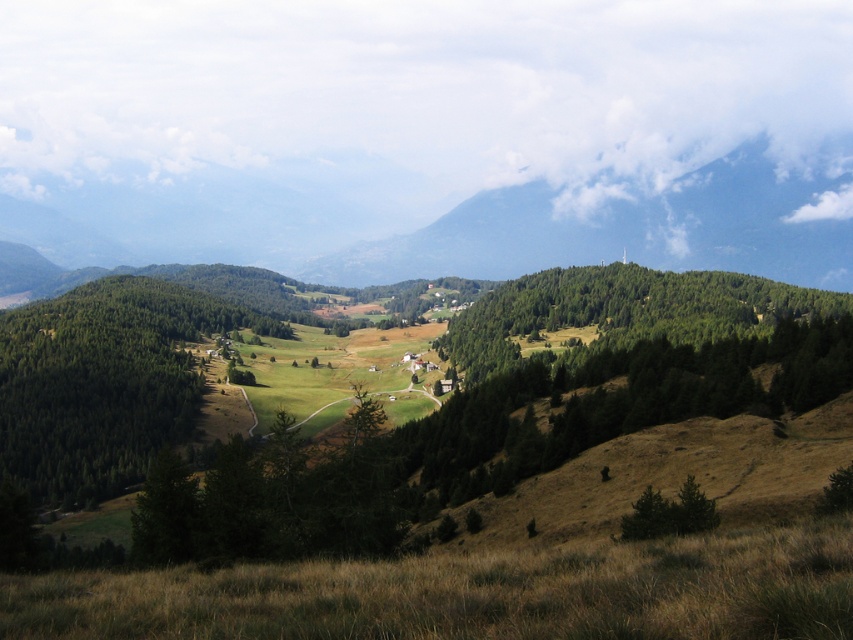
Is point (546, 221) positioned behind point (676, 339)?

Yes, it is.

Between point (544, 236) and point (596, 310), which one is positioned behind?

The point (544, 236) is more distant.

You are a GUI agent. You are given a task and a screenshot of the screen. Output one action in this format:
    pyautogui.click(x=<x>, y=<y>)
    Task: Click on the green forested mountain at upper center
    
    Given the screenshot: What is the action you would take?
    pyautogui.click(x=550, y=230)

Which is in front, point (273, 260) or point (48, 428)?

Point (48, 428)

How far apart are green forested mountain at upper center and green matte tree at lower left?

green forested mountain at upper center and green matte tree at lower left are 410.50 meters apart from each other.

Is point (732, 208) positioned before point (177, 442)?

No, it is not.

The width and height of the screenshot is (853, 640). In order to click on green forested mountain at upper center in this screenshot , I will do `click(550, 230)`.

Is green matte tree at lower left closer to camera compared to green leafy tree at center?

Yes, green matte tree at lower left is in front of green leafy tree at center.

Which is more to the left, green matte tree at lower left or green leafy tree at center?

green matte tree at lower left

The height and width of the screenshot is (640, 853). In order to click on green matte tree at lower left in this screenshot , I will do `click(103, 381)`.